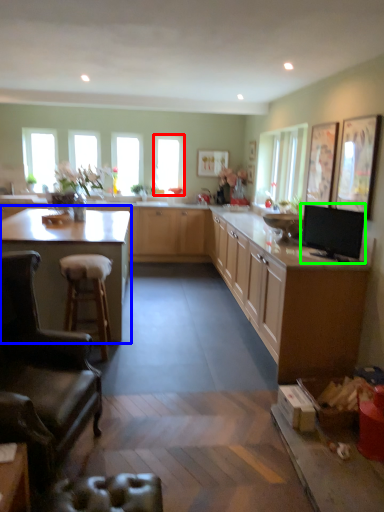
Question: Which object is positioned farthest from window (highlighted by a red box)? Select from countertop (highlighted by a blue box) and appliance (highlighted by a green box).

Choices:
 (A) countertop
 (B) appliance

Answer: (B)